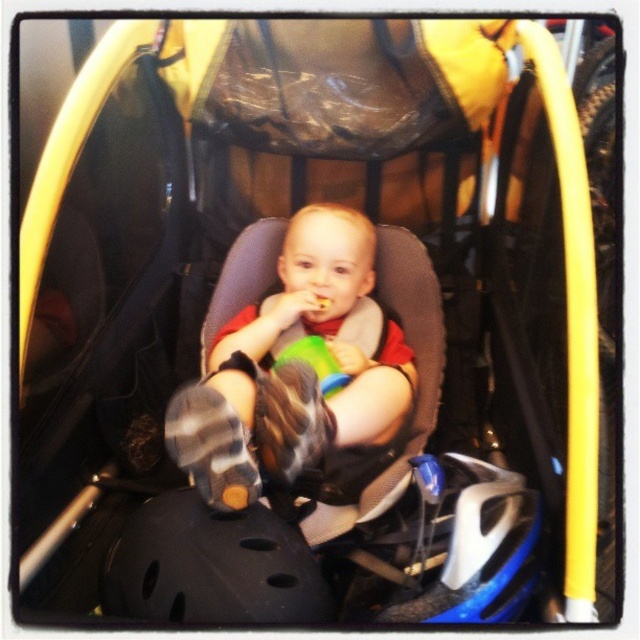
You are a photographer trying to capture a closeup shot of the matte gray baby at center and the black matte bicycle helmet at lower center. Since you want both objects to appear the same size in the photo, what should you do?

Since the matte gray baby at center is bigger than the black matte bicycle helmet at lower center, you should move closer to the black matte bicycle helmet at lower center and farther from the matte gray baby at center to make them appear the same size in the photo.

You are a photographer trying to capture a closeup shot of the matte gray baby at center and the black matte bicycle helmet at lower center. Since you want both subjects to be in focus, you need to know their relative sizes. Which object is taller?

The matte gray baby at center is taller than the black matte bicycle helmet at lower center.

You are a parent trying to ensure your child is safe while using the stroller. Based on the image, is the black matte bicycle helmet at lower center positioned in a way that it might interfere with the matte gray baby at center?

The black matte bicycle helmet at lower center is behind the matte gray baby at center, so it is not in a position to interfere with the baby.